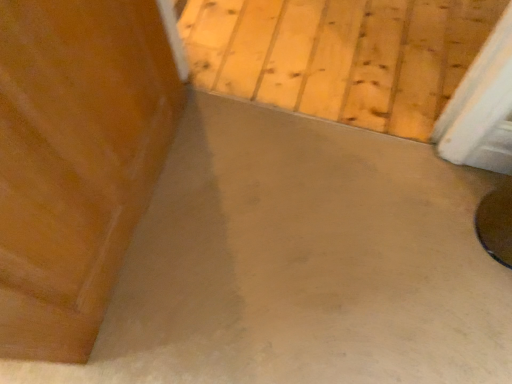
I want to click on blank area to the left of shiny brown table at lower right, so click(x=435, y=225).